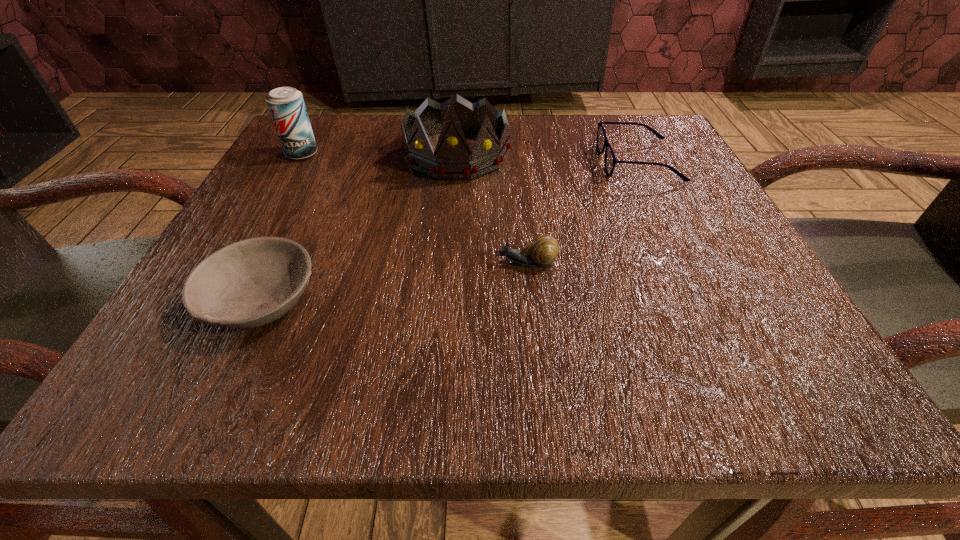
The width and height of the screenshot is (960, 540). I want to click on free space located 0.190m on the front-facing side of the spectacles, so click(x=494, y=162).

I want to click on free spot located 0.060m on the front-facing side of the spectacles, so pyautogui.click(x=567, y=162).

The height and width of the screenshot is (540, 960). Find the location of `blank space located 0.100m on the front-facing side of the spectacles`. blank space located 0.100m on the front-facing side of the spectacles is located at coordinates (545, 162).

This screenshot has height=540, width=960. Identify the location of free spot located on the back of the bowl. (314, 187).

Find the location of a particular element. This screenshot has height=540, width=960. tiara situated at the far edge is located at coordinates tap(452, 160).

This screenshot has height=540, width=960. Identify the location of beer can that is at the far edge. (286, 105).

Where is `spectacles that is positioned at the far edge`? The height and width of the screenshot is (540, 960). spectacles that is positioned at the far edge is located at coordinates (610, 161).

The width and height of the screenshot is (960, 540). I want to click on object that is at the near edge, so click(252, 282).

The width and height of the screenshot is (960, 540). I want to click on beer can located at the left edge, so click(x=286, y=105).

You are a GUI agent. You are given a task and a screenshot of the screen. Output one action in this format:
    pyautogui.click(x=<x>, y=<y>)
    Task: Click on the bowl that is at the left edge
    This screenshot has width=960, height=540.
    Given the screenshot: What is the action you would take?
    pyautogui.click(x=252, y=282)